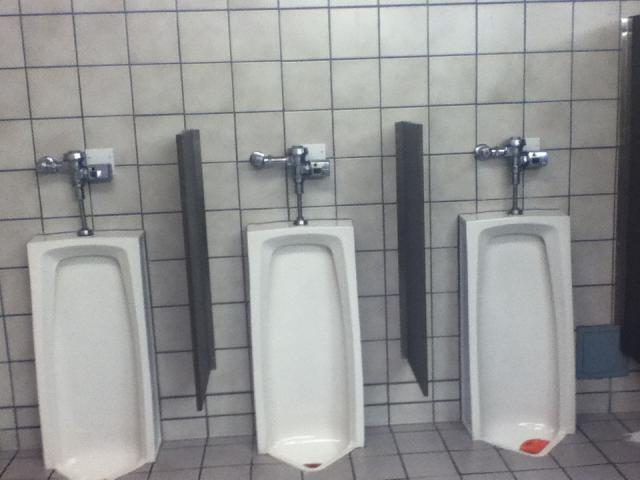
This screenshot has width=640, height=480. What are the coordinates of `urinal` in the screenshot? It's located at (104, 357), (317, 352), (532, 356).